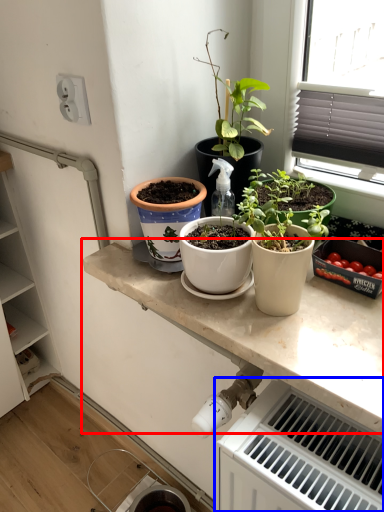
Question: Which point is further to the camera, countertop (highlighted by a red box) or radiator (highlighted by a blue box)?

Choices:
 (A) countertop
 (B) radiator

Answer: (A)